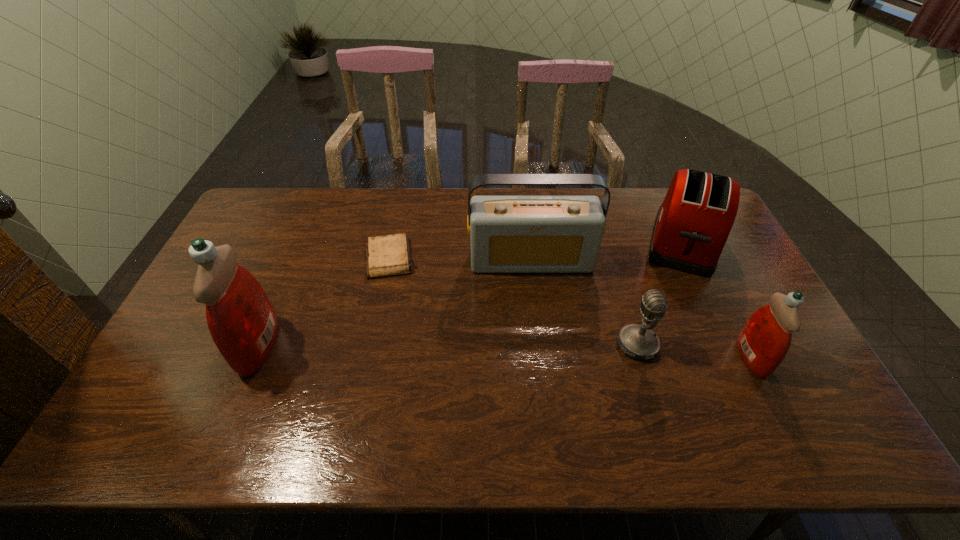
The image size is (960, 540). Identify the location of free space between the tallest object and the toaster. (471, 294).

The height and width of the screenshot is (540, 960). I want to click on empty location between the third object from left to right and the second shortest object, so click(585, 303).

Where is `free spot between the diary and the fourth object from right to left`? free spot between the diary and the fourth object from right to left is located at coordinates (461, 259).

Where is `free space that is in between the microphone and the tallest object`? The image size is (960, 540). free space that is in between the microphone and the tallest object is located at coordinates (448, 345).

In order to click on free space between the shorter detergent and the diary in this screenshot , I will do `click(570, 307)`.

Identify the location of free space between the second object from left to right and the right detergent. (570, 307).

Locate an element on the screen. The image size is (960, 540). vacant space that's between the right detergent and the toaster is located at coordinates (717, 300).

I want to click on vacant space that is in between the fourth object from right to left and the second shortest object, so click(x=585, y=303).

Choose which object is the fourth nearest neighbor to the shortest object. Please provide its 2D coordinates. Your answer should be formatted as a tuple, i.e. [(x, y)], where the tuple contains the x and y coordinates of a point satisfying the conditions above.

[(692, 225)]

The height and width of the screenshot is (540, 960). Find the location of `object that is the fourth closest to the diary`. object that is the fourth closest to the diary is located at coordinates (692, 225).